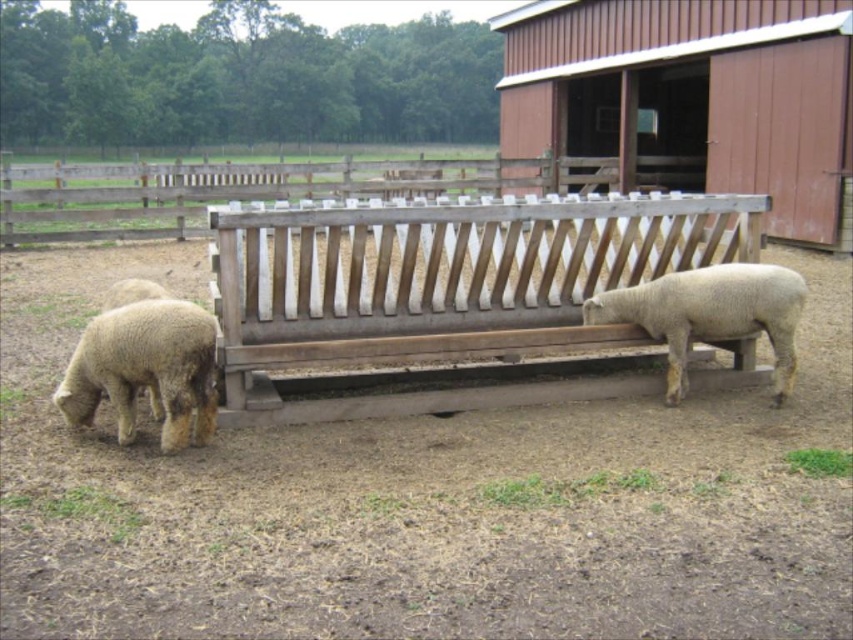
You are a farmer who wants to place a new water dispenser exactly at the center of the farm scene. The existing weathered wood bench at center is located at coordinates point 0.445, 0.516. Can you determine if the bench is already positioned at the exact center of the farm scene?

The weathered wood bench at center is located at coordinates point (439, 284). Since the exact center of the scene would typically be at coordinates (426, 320), the bench is slightly offset to the left and down from the true center.

From the picture: You are a farmer checking the farm layout. You see the brown wooden barn at upper center and the green leafy grass at lower right. Which object takes up more space in the image?

The brown wooden barn at upper center is bigger than the green leafy grass at lower right, so it takes up more space in the image.